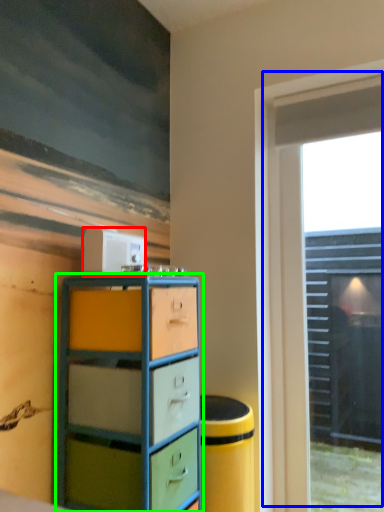
Question: Considering the real-world distances, which object is closest to appliance (highlighted by a red box)? window (highlighted by a blue box) or chest of drawers (highlighted by a green box).

Choices:
 (A) window
 (B) chest of drawers

Answer: (B)